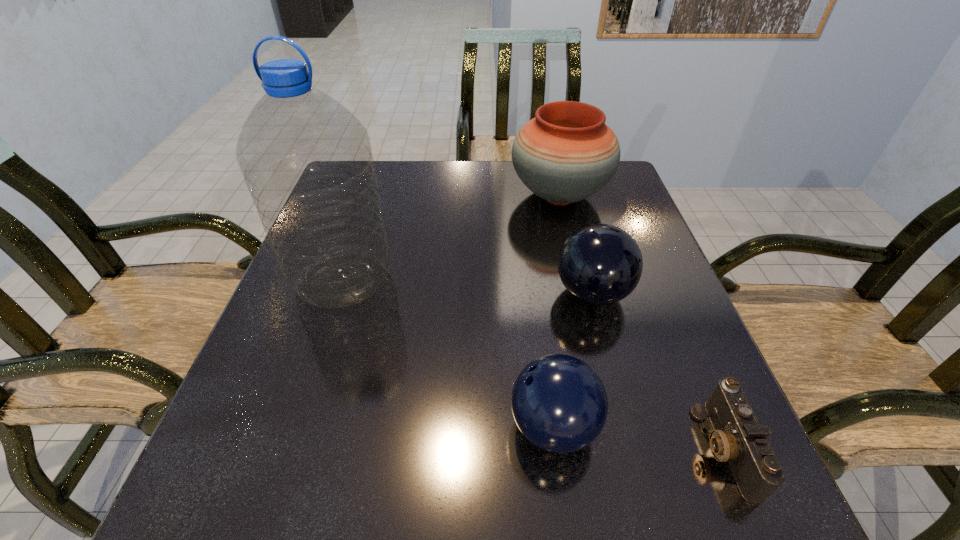
Select which object appears as the third closest to the farthest object. Please provide its 2D coordinates. Your answer should be formatted as a tuple, i.e. [(x, y)], where the tuple contains the x and y coordinates of a point satisfying the conditions above.

[(559, 403)]

Find the location of a particular element. This screenshot has height=540, width=960. blank area in the image that satisfies the following two spatial constraints: 1. on the back side of the leftmost object; 2. on the left side of the farthest object is located at coordinates coord(371,195).